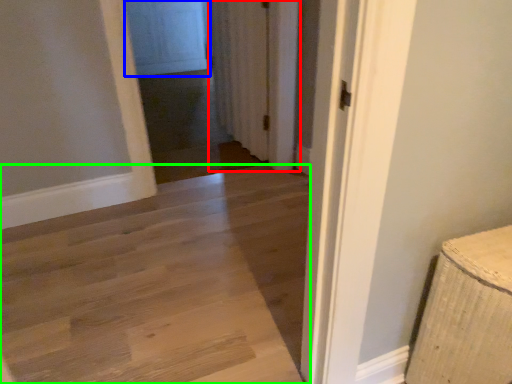
Question: Based on their relative distances, which object is farther from curtain (highlighted by a red box)? Choose from screen door (highlighted by a blue box) and path (highlighted by a green box).

Choices:
 (A) screen door
 (B) path

Answer: (A)